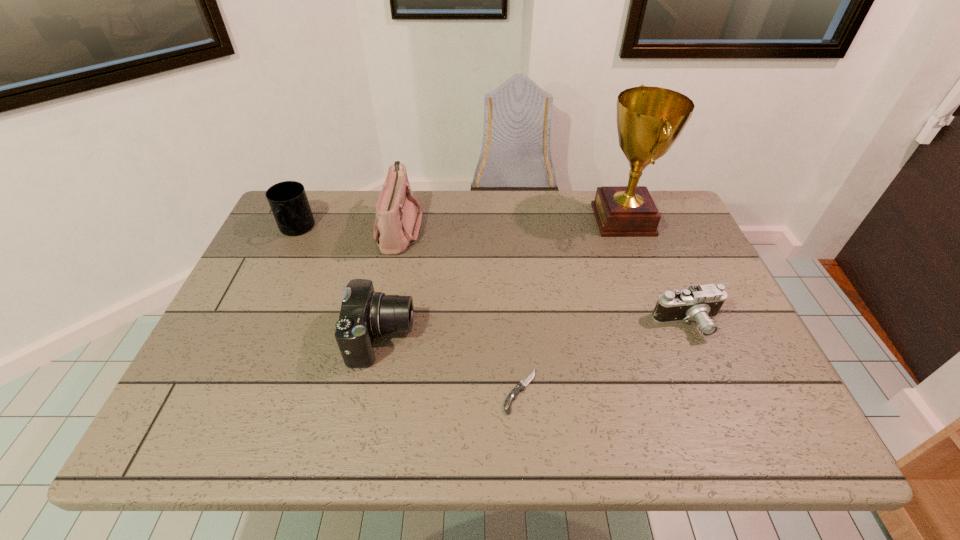
At what (x,y) coordinates should I click in order to perform the action: click on free space between the award and the second shortest object. Please return your answer as a coordinate pair (x, y). Looking at the image, I should click on (656, 272).

The height and width of the screenshot is (540, 960). Find the location of `free point between the fifth shortest object and the left camera`. free point between the fifth shortest object and the left camera is located at coordinates (391, 283).

Identify the location of free spot between the award and the leftmost object. The image size is (960, 540). (460, 225).

This screenshot has height=540, width=960. In order to click on vacant area that lies between the tallest object and the mug in this screenshot , I will do `click(460, 225)`.

Image resolution: width=960 pixels, height=540 pixels. I want to click on free spot between the shorter camera and the mug, so click(492, 277).

Image resolution: width=960 pixels, height=540 pixels. What are the coordinates of `unoccupied position between the award and the shortest object` in the screenshot? It's located at (571, 305).

This screenshot has height=540, width=960. I want to click on vacant area that lies between the mug and the shoulder bag, so click(x=348, y=229).

Locate an element on the screen. The image size is (960, 540). free space between the mug and the second tallest object is located at coordinates (348, 229).

Select which object is the fifth closest to the mug. Please provide its 2D coordinates. Your answer should be formatted as a tuple, i.e. [(x, y)], where the tuple contains the x and y coordinates of a point satisfying the conditions above.

[(699, 303)]

In order to click on object identified as the fourth closest to the pocketknife in this screenshot , I will do [x=649, y=119].